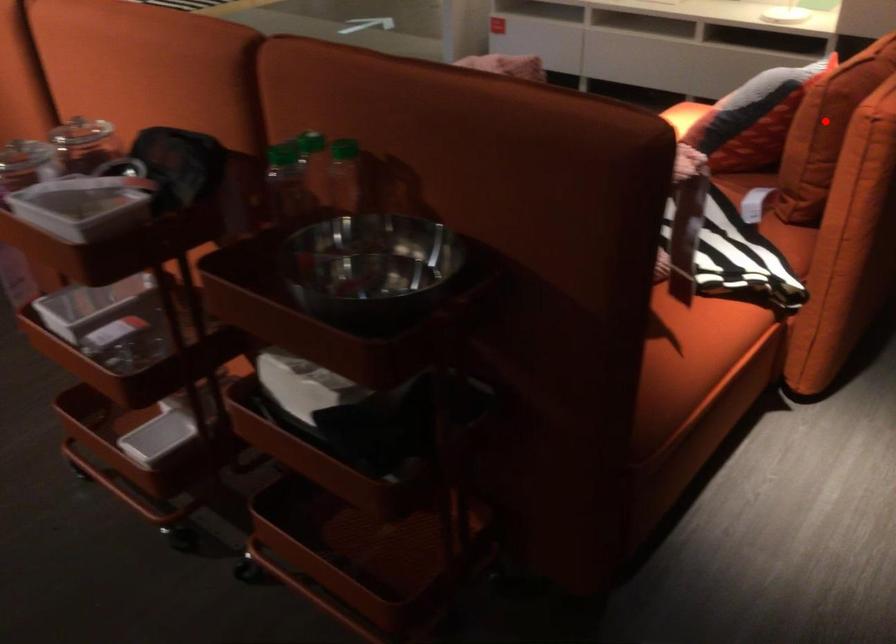
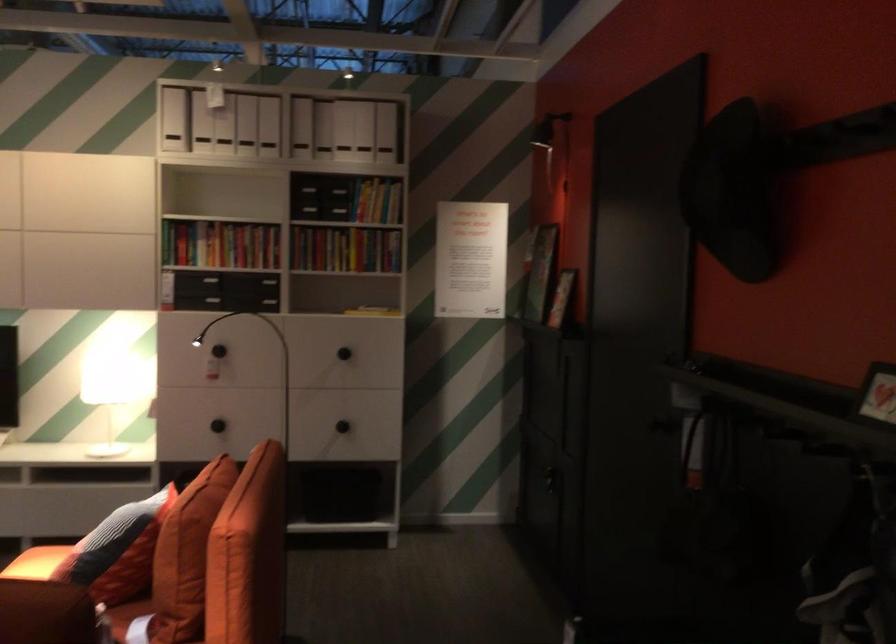
Where in the second image is the point corresponding to the highlighted location from the first image?

(186, 554)